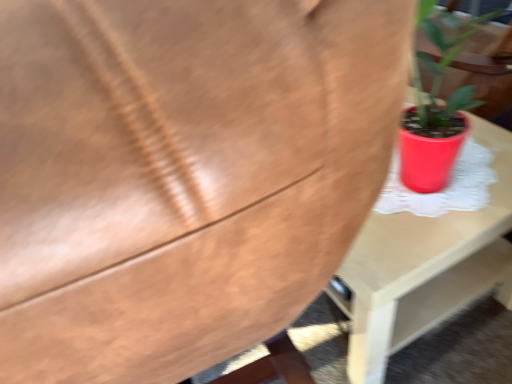
What is the approximate height of matte plastic table at right?

The height of matte plastic table at right is 17.60 inches.

Locate an element on the screen. The height and width of the screenshot is (384, 512). matte plastic table at right is located at coordinates (424, 267).

This screenshot has width=512, height=384. Describe the element at coordinates (424, 267) in the screenshot. I see `matte plastic table at right` at that location.

The image size is (512, 384). What are the coordinates of `matte plastic table at right` in the screenshot? It's located at (424, 267).